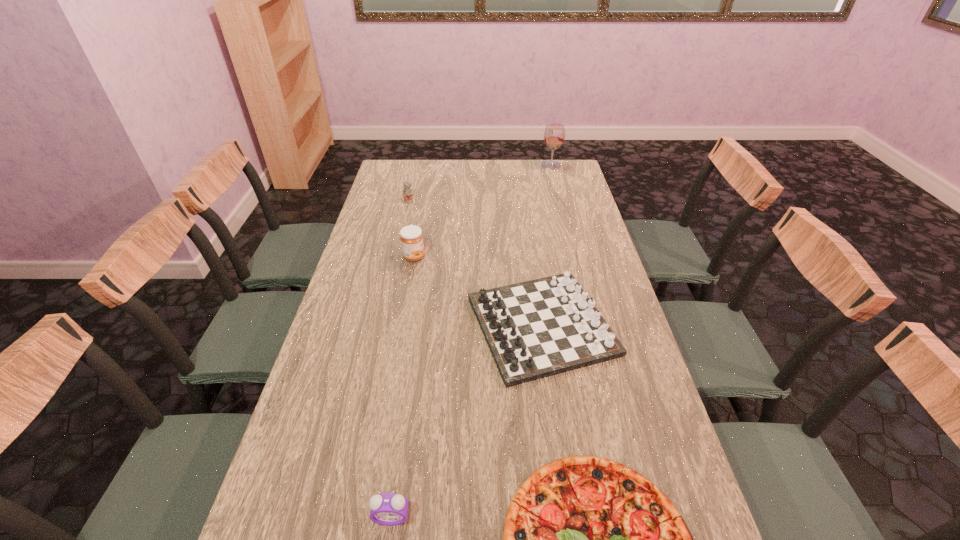
In order to click on the farthest object in this screenshot , I will do `click(554, 135)`.

The height and width of the screenshot is (540, 960). I want to click on the tallest object, so click(554, 135).

You are a GUI agent. You are given a task and a screenshot of the screen. Output one action in this format:
    pyautogui.click(x=<x>, y=<y>)
    Task: Click on the third farthest object
    
    Given the screenshot: What is the action you would take?
    pyautogui.click(x=411, y=237)

Identify the location of jam. (411, 237).

This screenshot has height=540, width=960. I want to click on chessboard, so (539, 328).

In order to click on the fifth nearest object in this screenshot , I will do `click(407, 194)`.

Where is `alarm clock`? The image size is (960, 540). alarm clock is located at coordinates (389, 509).

The image size is (960, 540). Find the location of `vacant space situated on the front of the wineglass`. vacant space situated on the front of the wineglass is located at coordinates (562, 205).

In order to click on vacant space situated on the front label of the fourth nearest object in this screenshot , I will do `click(520, 257)`.

You are a GUI agent. You are given a task and a screenshot of the screen. Output one action in this format:
    pyautogui.click(x=<x>, y=<y>)
    Task: Click on the vacant area situated 0.330m on the front of the third nearest object
    Image resolution: width=960 pixels, height=540 pixels.
    Given the screenshot: What is the action you would take?
    pyautogui.click(x=570, y=529)